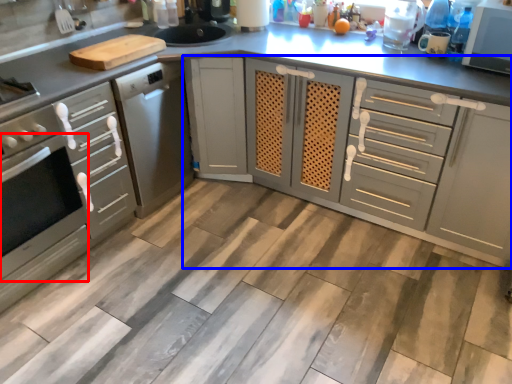
Question: Which of the following is the farthest to the observer, oven (highlighted by a red box) or cabinetry (highlighted by a blue box)?

Choices:
 (A) oven
 (B) cabinetry

Answer: (B)